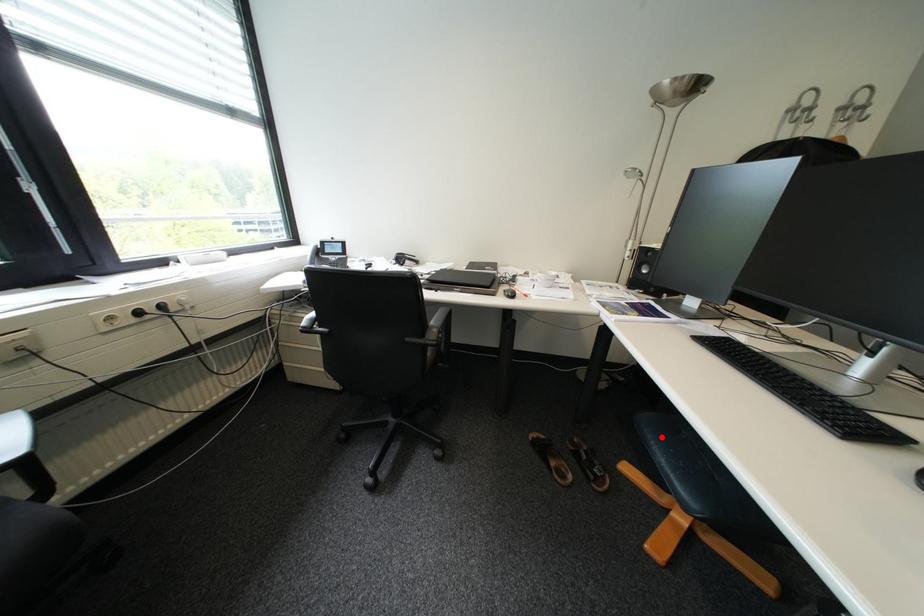
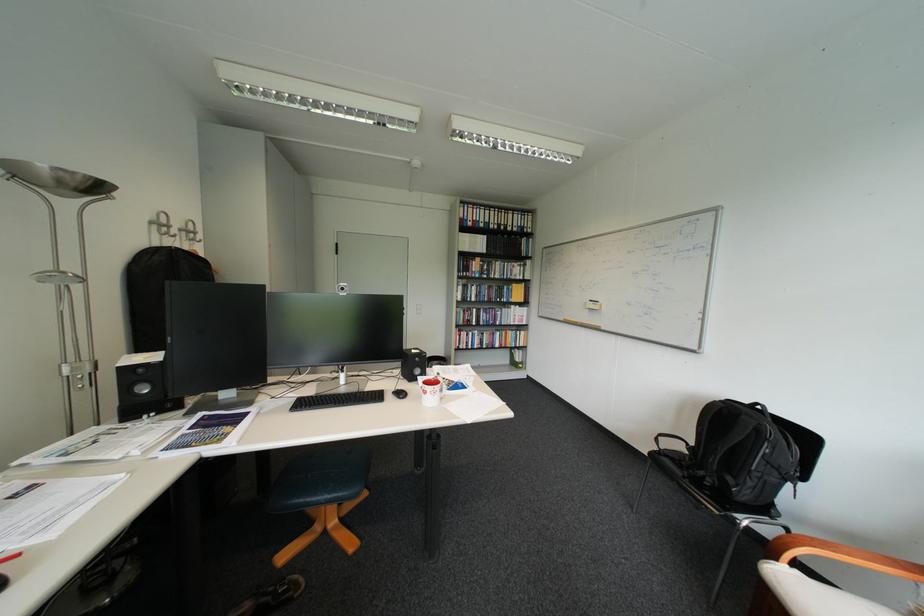
In the second image, find the point that corresponds to the highlighted location in the first image.

(313, 501)